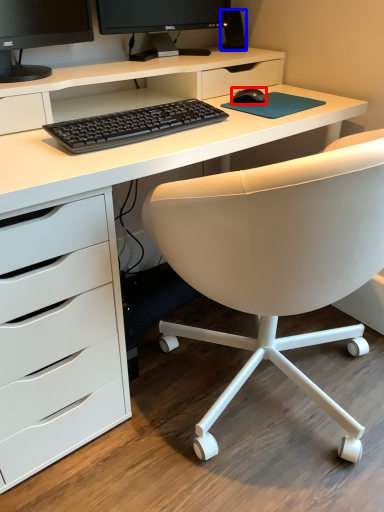
Question: Which object is further to the camera taking this photo, mouse (highlighted by a red box) or speaker (highlighted by a blue box)?

Choices:
 (A) mouse
 (B) speaker

Answer: (B)